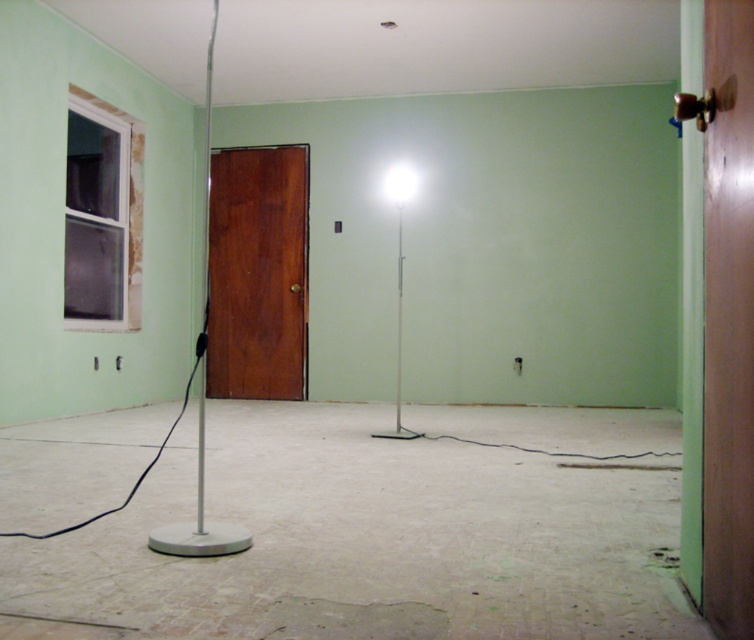
Question: Which point appears closest to the camera in this image?

Choices:
 (A) (749, 588)
 (B) (250, 337)
 (C) (394, 413)

Answer: (A)

Question: Which object is farther from the camera taking this photo?

Choices:
 (A) shiny brown door at center
 (B) white glossy floor lamp at center

Answer: (A)

Question: Is shiny brown door at center in front of white glossy floor lamp at center?

Choices:
 (A) yes
 (B) no

Answer: (B)

Question: Does wooden door at right lie behind shiny brown door at center?

Choices:
 (A) no
 (B) yes

Answer: (A)

Question: Can you confirm if shiny brown door at center is smaller than white glossy floor lamp at center?

Choices:
 (A) yes
 (B) no

Answer: (B)

Question: Which of the following is the farthest from the observer?

Choices:
 (A) (737, 115)
 (B) (219, 182)

Answer: (B)